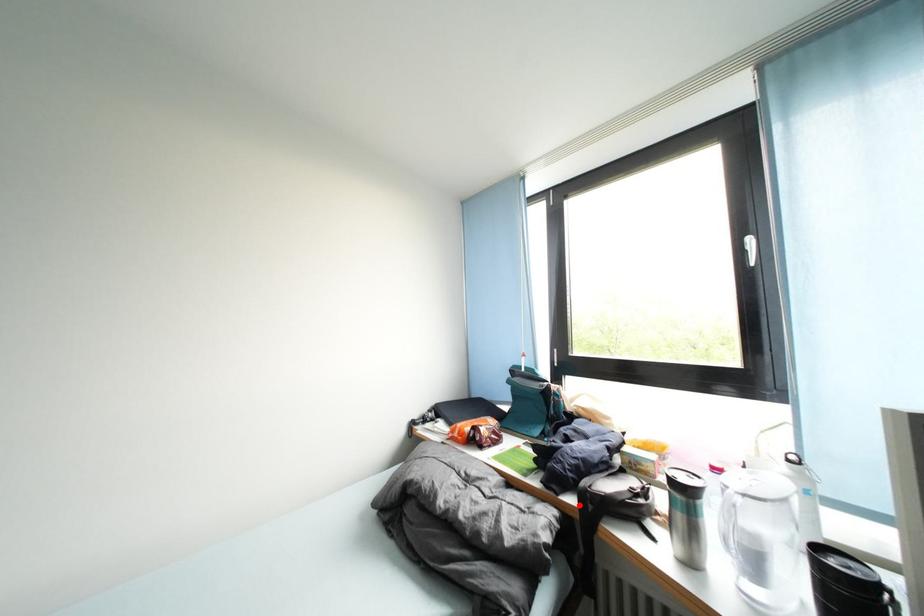
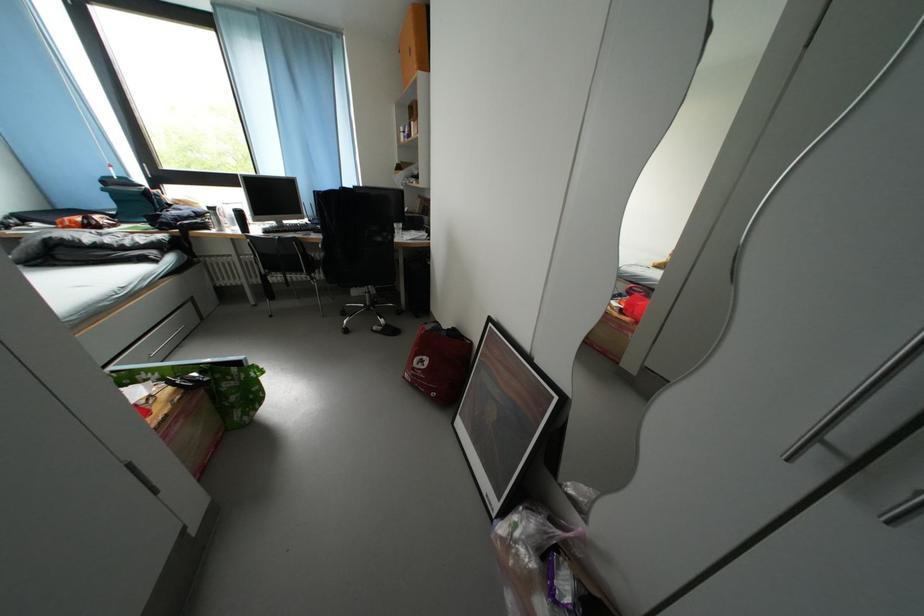
Question: I am providing you with two images of the same scene from different viewpoints. A red point is marked on the first image. Is the red point's position out of view in image 2?

Choices:
 (A) Yes
 (B) No

Answer: (A)